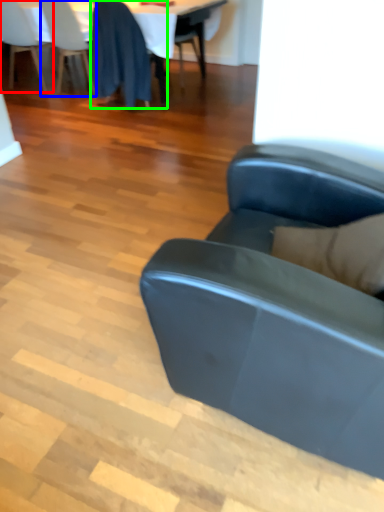
Question: Which object is the farthest from chair (highlighted by a red box)? Choose among these: chair (highlighted by a blue box) or chair (highlighted by a green box).

Choices:
 (A) chair
 (B) chair

Answer: (B)